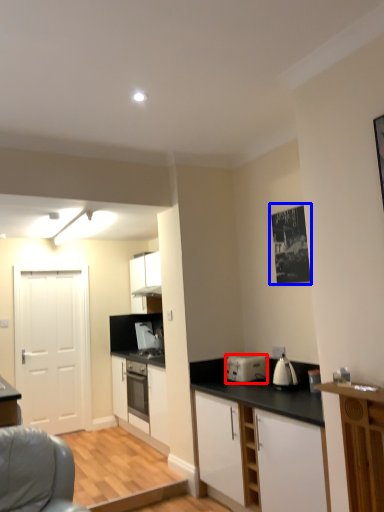
Question: Among these objects, which one is nearest to the camera, kitchen appliance (highlighted by a red box) or picture frame (highlighted by a blue box)?

Choices:
 (A) kitchen appliance
 (B) picture frame

Answer: (B)